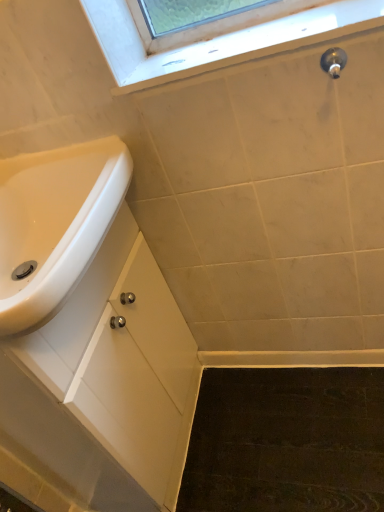
Question: Is white glossy sink at lower left in front of or behind polished chrome faucet at upper right in the image?

Choices:
 (A) front
 (B) behind

Answer: (A)

Question: Looking at the image, does white glossy sink at lower left seem bigger or smaller compared to polished chrome faucet at upper right?

Choices:
 (A) small
 (B) big

Answer: (B)

Question: Considering the real-world distances, which object is closest to the polished chrome faucet at upper right?

Choices:
 (A) white glossy sink at lower left
 (B) clear glass window at upper center
 (C) white matte cabinet at lower left

Answer: (B)

Question: Estimate the real-world distances between objects in this image. Which object is closer to the polished chrome faucet at upper right?

Choices:
 (A) clear glass window at upper center
 (B) white matte cabinet at lower left
 (C) white glossy sink at lower left

Answer: (A)